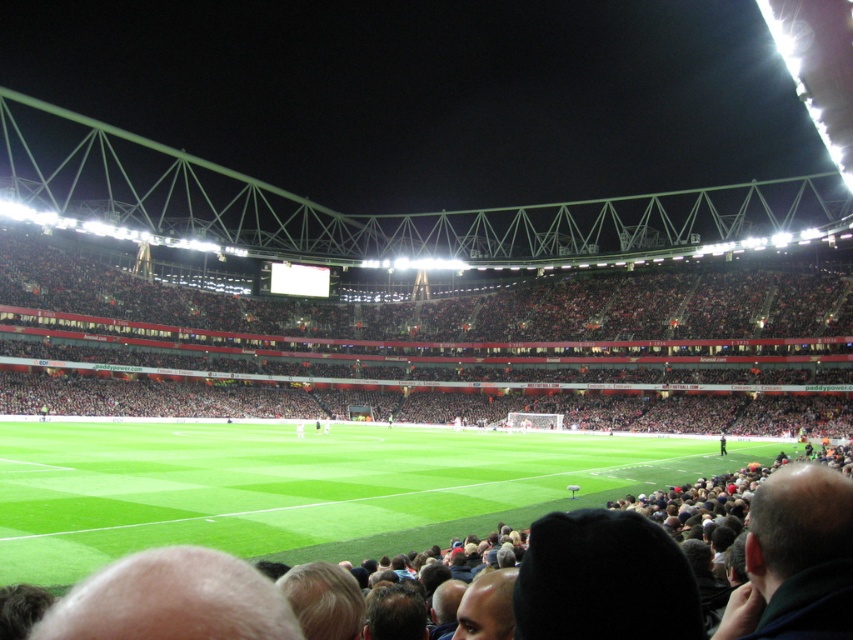
You are a drone operator trying to capture aerial footage of the football stadium. You need to ensure that both the green grass at center and the dark red seats at center are clearly visible in your shot. Based on their sizes, which object should you focus on first to ensure it occupies more of the frame?

The dark red seats at center are larger than the green grass at center, so focusing on the dark red seats at center first will ensure it occupies more of the frame.

You are a drone operator trying to capture a photo of the green grass at center and dark red seats at center from above. Based on the scene description, which object should appear below the other in the photo?

The green grass at center is positioned under dark red seats at center, so in the photo taken from above, the green grass at center will appear below the dark red seats at center.